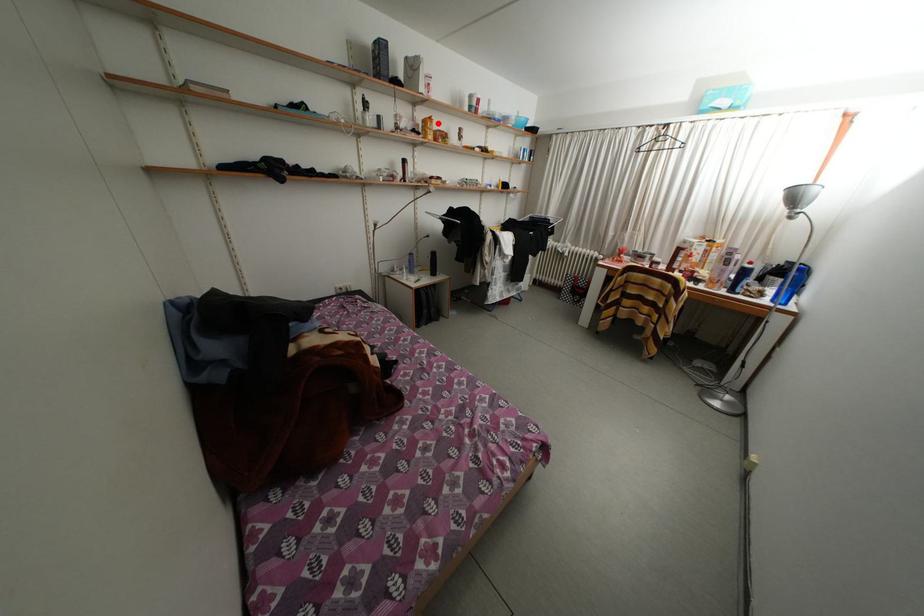
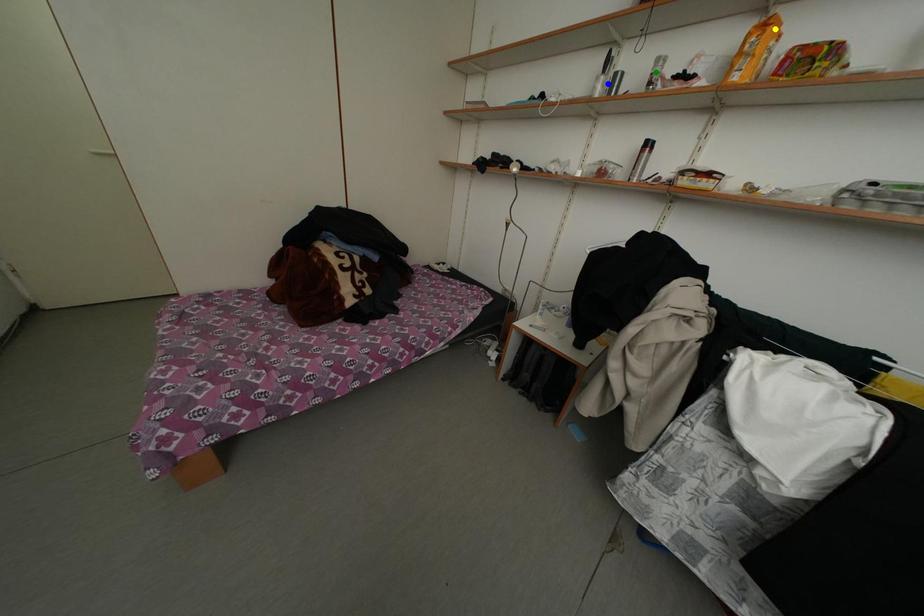
Question: I am providing you with two images of the same scene from different viewpoints. A red point is marked on the first image. You are given multiple points on the second image. Can you choose the point in image 2 that corresponds to the point in image 1?

Choices:
 (A) green point
 (B) blue point
 (C) yellow point

Answer: (C)